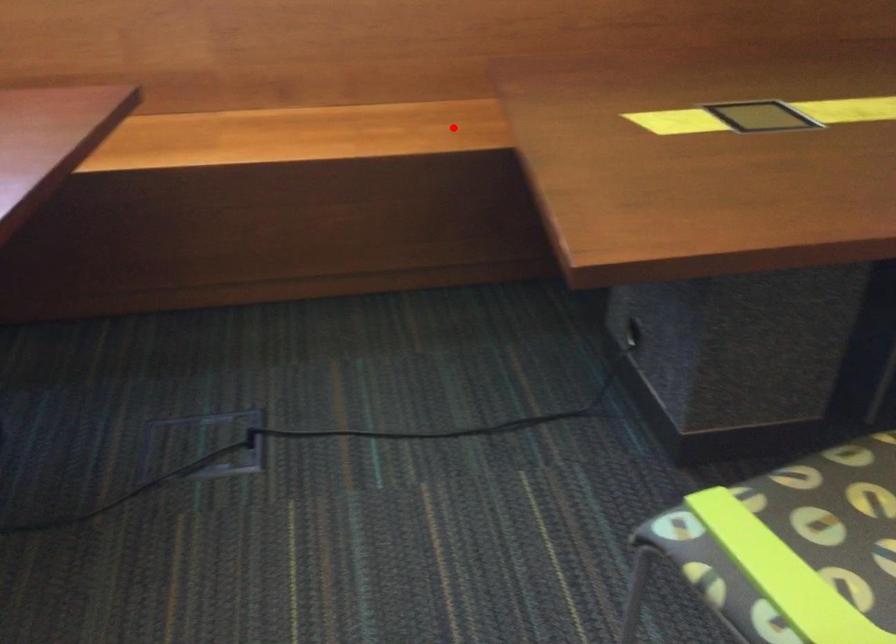
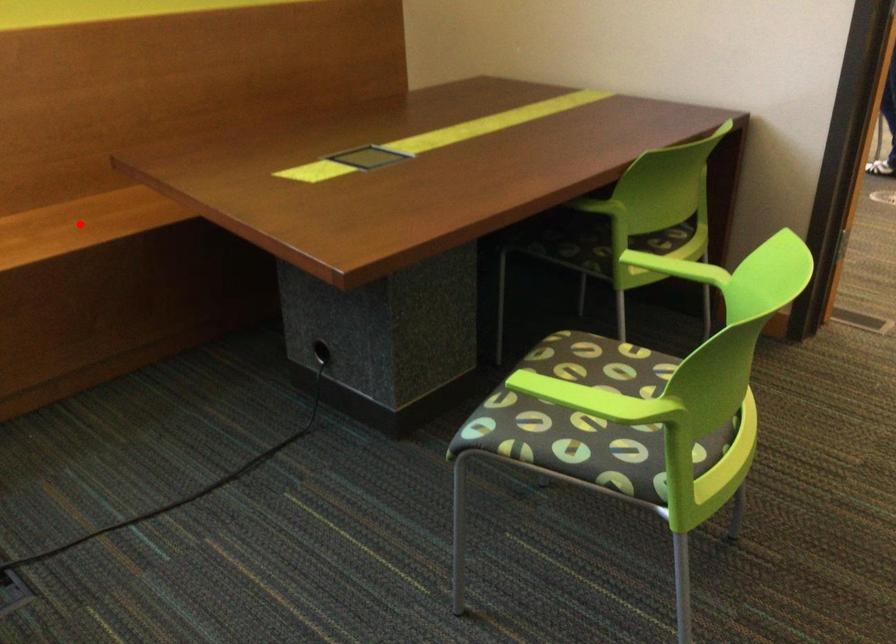
I am providing you with two images of the same scene from different viewpoints. A red point is marked on the first image and another point is marked on the second image. Is the red point in image1 aligned with the point shown in image2?

Yes